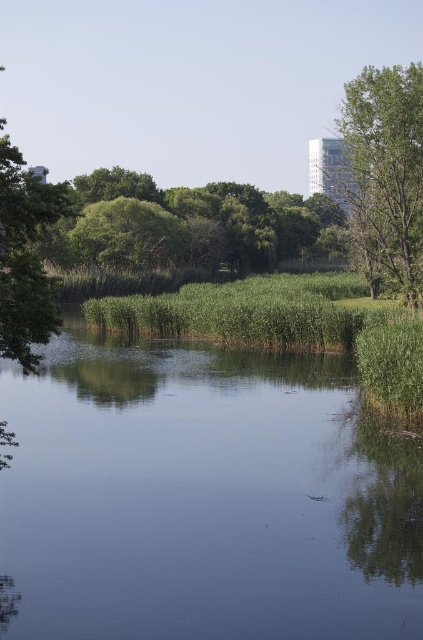
You are standing at the edge of the green grassy river at center and want to reach the green leafy tree at left. Which direction should you walk to get closer to the tree?

Since the green grassy river at center is smaller in size compared to the green leafy tree at left, you should walk towards the left direction to get closer to the green leafy tree at left.

You are standing at the edge of the green grassy river at center and want to reach the green leafy tree at left. Which direction should you walk to get closer to the tree?

To reach the green leafy tree at left, you should walk backward because the green grassy river at center is in front of the green leafy tree at left, meaning the tree is behind you relative to your current position.